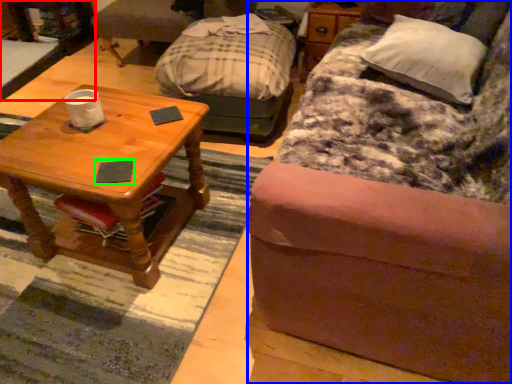
Question: Considering the real-world distances, which object is farthest from desk (highlighted by a red box)? studio couch (highlighted by a blue box) or pad (highlighted by a green box)?

Choices:
 (A) studio couch
 (B) pad

Answer: (A)